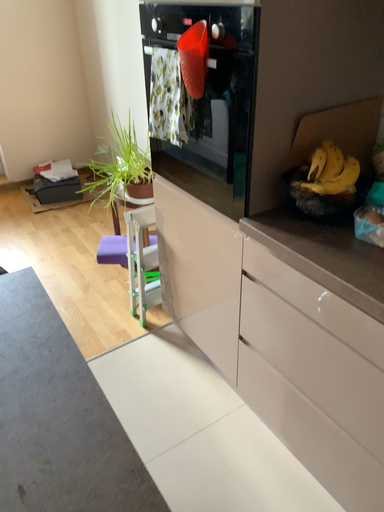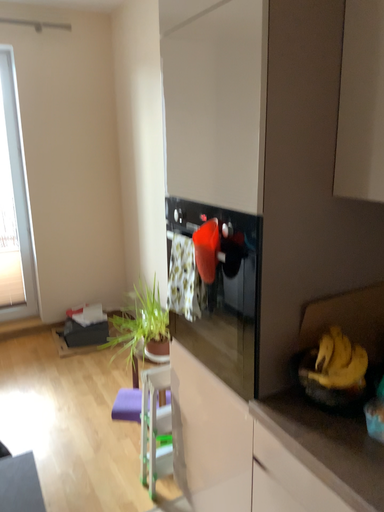
Question: How did the camera likely rotate when shooting the video?

Choices:
 (A) rotated upward
 (B) rotated downward

Answer: (A)